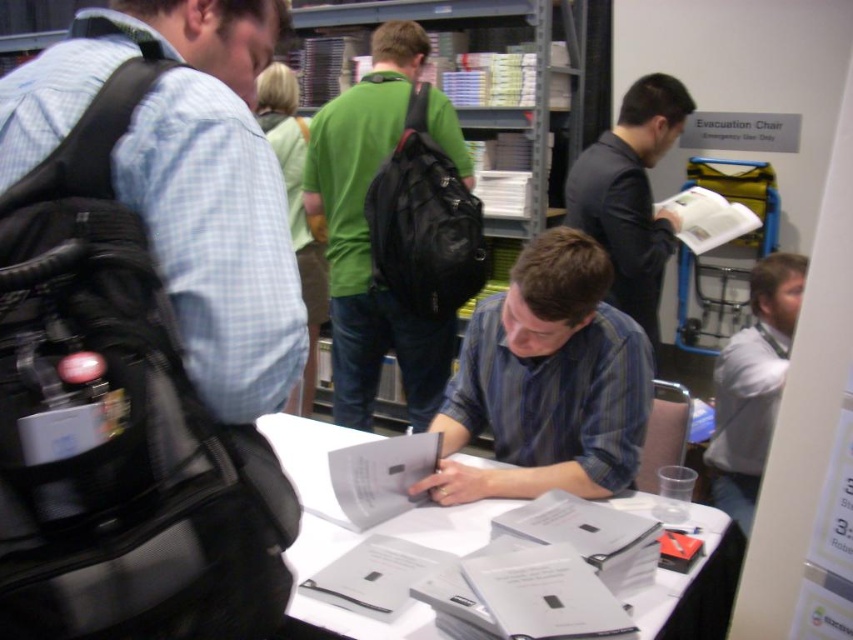
Question: Which of the following is the closest to the observer?

Choices:
 (A) (601, 387)
 (B) (341, 208)
 (C) (747, 506)

Answer: (A)

Question: Estimate the real-world distances between objects in this image. Which object is closer to the green matte backpack at center?

Choices:
 (A) light blue checkered shirt at left
 (B) white paper at center
 (C) white shirt at right
 (D) blue striped shirt at center

Answer: (D)

Question: Is blue striped shirt at center positioned in front of white shirt at right?

Choices:
 (A) no
 (B) yes

Answer: (B)

Question: Is light blue checkered shirt at left to the left of white shirt at right from the viewer's perspective?

Choices:
 (A) no
 (B) yes

Answer: (B)

Question: Which object is farther from the camera taking this photo?

Choices:
 (A) green matte backpack at center
 (B) white shirt at right

Answer: (A)

Question: Does white shirt at right have a smaller size compared to white paper at center?

Choices:
 (A) no
 (B) yes

Answer: (B)